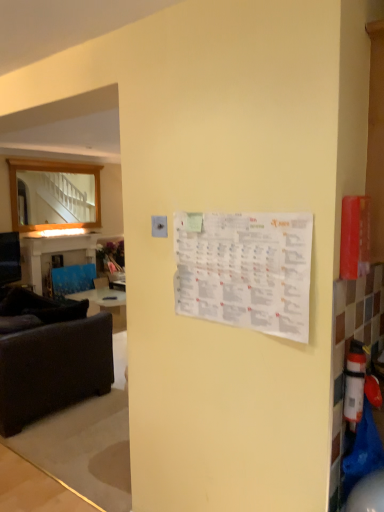
Question: Is the position of white plastic extinguisher at right less distant than that of blue fabric table at left?

Choices:
 (A) yes
 (B) no

Answer: (A)

Question: Is white plastic extinguisher at right further to the viewer compared to blue fabric table at left?

Choices:
 (A) yes
 (B) no

Answer: (B)

Question: Is white plastic extinguisher at right thinner than blue fabric table at left?

Choices:
 (A) yes
 (B) no

Answer: (A)

Question: Is white plastic extinguisher at right smaller than blue fabric table at left?

Choices:
 (A) no
 (B) yes

Answer: (B)

Question: Is white plastic extinguisher at right positioned far away from blue fabric table at left?

Choices:
 (A) no
 (B) yes

Answer: (B)

Question: From a real-world perspective, is white plastic extinguisher at right beneath blue fabric table at left?

Choices:
 (A) no
 (B) yes

Answer: (A)

Question: From the image's perspective, is blue fabric table at left located above dark brown fabric studio couch at left?

Choices:
 (A) no
 (B) yes

Answer: (B)

Question: Is blue fabric table at left taller than dark brown fabric studio couch at left?

Choices:
 (A) no
 (B) yes

Answer: (B)

Question: Is blue fabric table at left aimed at dark brown fabric studio couch at left?

Choices:
 (A) no
 (B) yes

Answer: (A)

Question: Considering the relative positions of blue fabric table at left and dark brown fabric studio couch at left in the image provided, is blue fabric table at left to the left of dark brown fabric studio couch at left from the viewer's perspective?

Choices:
 (A) yes
 (B) no

Answer: (A)

Question: From a real-world perspective, is blue fabric table at left physically above dark brown fabric studio couch at left?

Choices:
 (A) yes
 (B) no

Answer: (A)

Question: Is blue fabric table at left not inside dark brown fabric studio couch at left?

Choices:
 (A) no
 (B) yes

Answer: (B)

Question: Is wooden frame mirror at left positioned before white paper calendar at center?

Choices:
 (A) no
 (B) yes

Answer: (A)